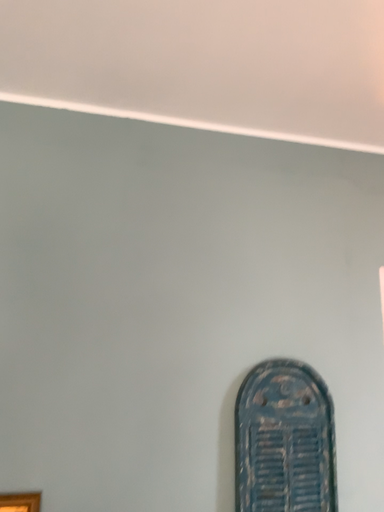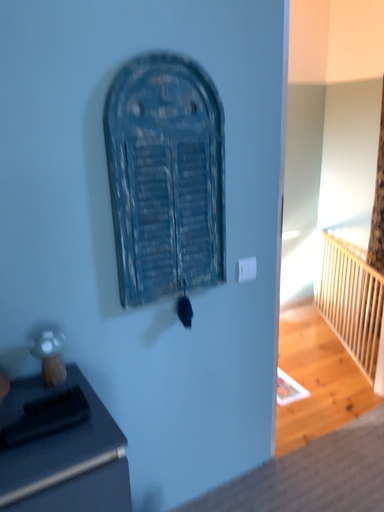
Question: Which way did the camera rotate in the video?

Choices:
 (A) rotated right
 (B) rotated left

Answer: (A)